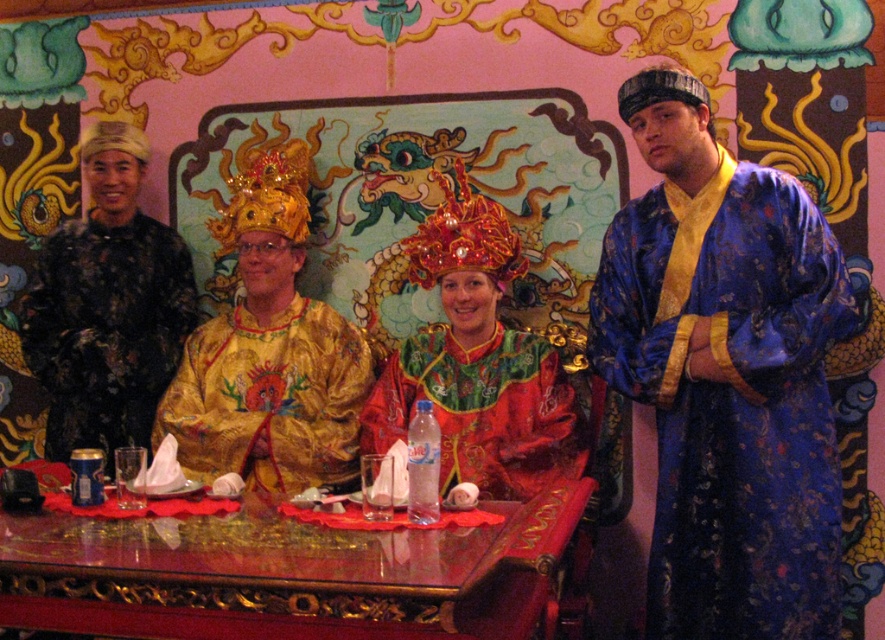
From the picture: In the festive scene described, there are two people wearing the blue silk robe at center and the gold brocade robe at left. Based on their positions, which robe is closer to the right side of the image?

The blue silk robe at center is to the right of the gold brocade robe at left, so the blue silk robe at center is closer to the right side of the image.

From the picture: In the image, there is a point marked at coordinates (726, 374). Based on the scene description, which object is this point located on?

The point at coordinates (726, 374) is located on the blue silk robe at center.

You are a photographer standing 2 meters away from the group. You want to take a photo that includes both the blue silk robe at center and the gold brocade robe at left. Can you fit both into your camera frame if your camera has a maximum horizontal field of view of 1.5 meters?

The distance between the blue silk robe at center and the gold brocade robe at left is 1.64 meters. Since your camera has a maximum horizontal field of view of 1.5 meters, which is less than the distance between them, you cannot fit both into the frame.